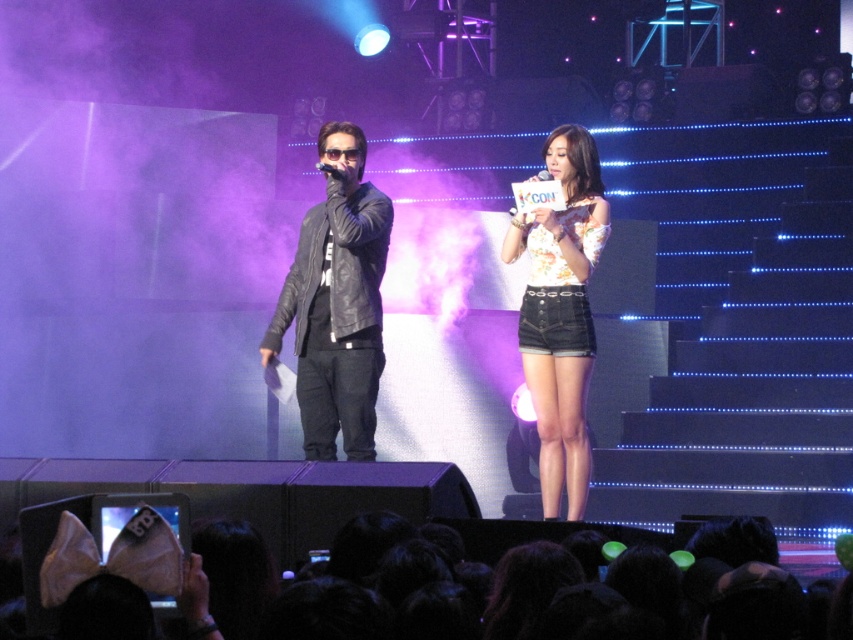
You are a photographer at the concert. You need to capture a closeup shot of both the leather jacket at center and the floral fabric top at center in the same frame. Given that your camera has a fixed focal length, which object should you focus on to ensure both are in focus?

The leather jacket at center is larger in size than the floral fabric top at center. To ensure both are in focus, you should focus on the leather jacket at center since it is larger and will require less adjustment to keep both in the frame.

From the picture: You are a photographer positioned at the front of the stage. You need to capture a photo of the floral fabric top at center. What are the exact coordinates where you should focus your camera lens to ensure the top is centered in the image?

The exact coordinates to focus the camera lens on the floral fabric top at center are point (x=561, y=312).

You are a photographer at the event and want to capture a photo where both the floral fabric top at center and the matte black microphone at center are visible. Considering their heights, which object should you ensure is closer to the camera to include both in the frame?

The floral fabric top at center is taller than the matte black microphone at center. To include both in the frame, position the taller floral fabric top at center closer to the camera so that its height doesn